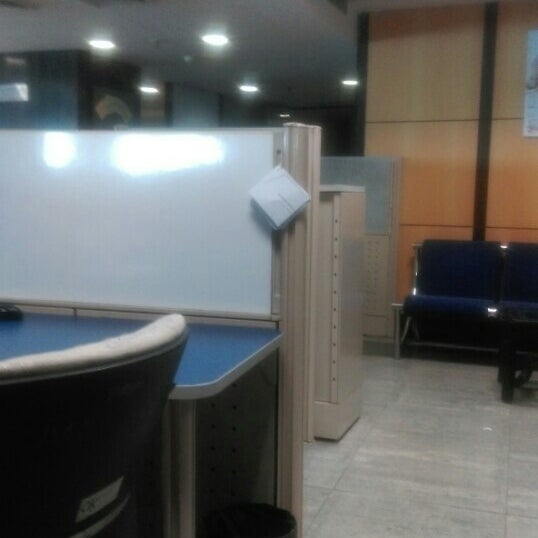
Image resolution: width=538 pixels, height=538 pixels. Find the location of `wall`. wall is located at coordinates (56, 97).